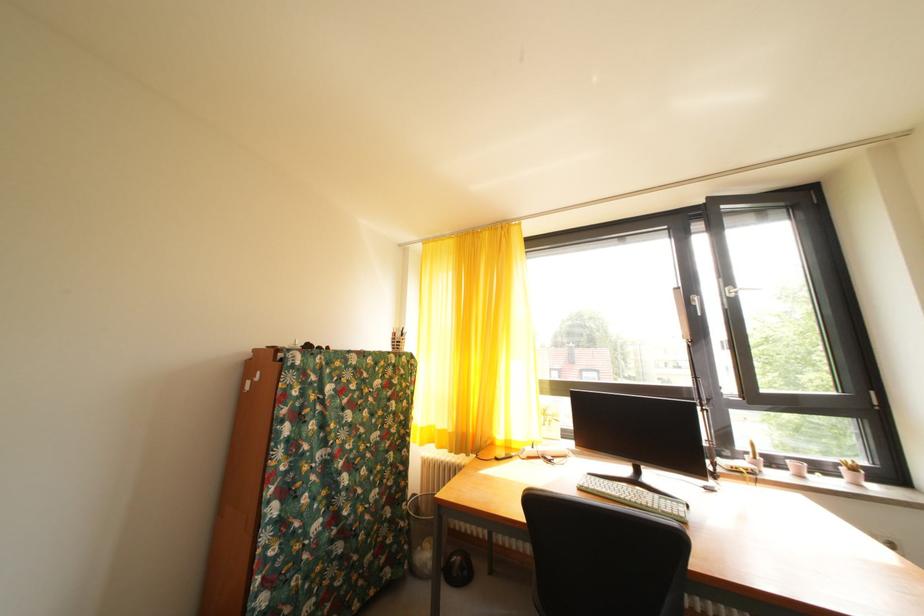
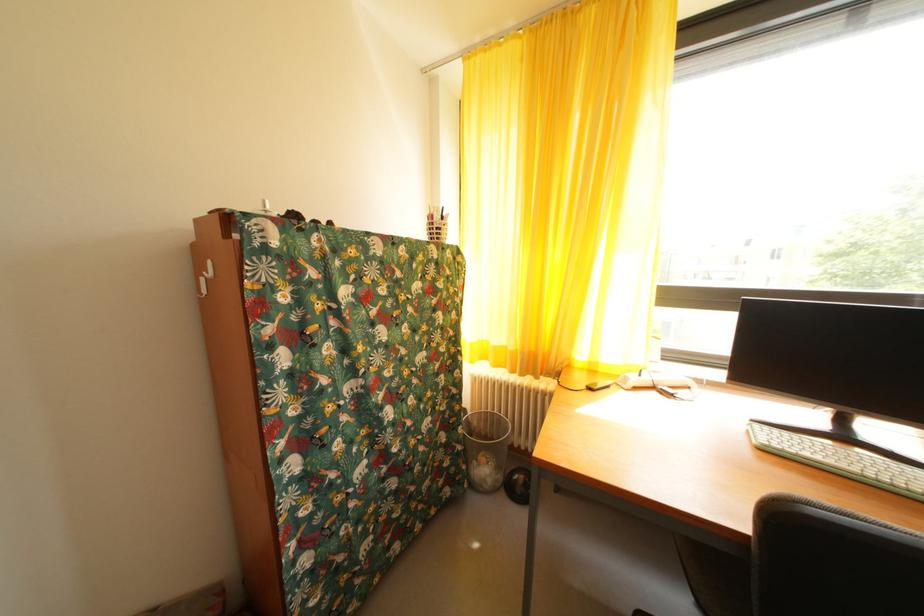
Locate, in the second image, the point that corresponds to point (403, 339) in the first image.

(440, 223)